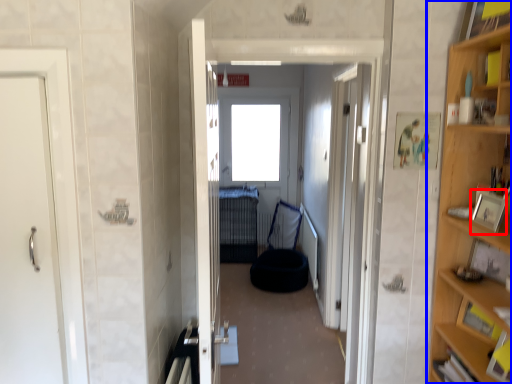
Question: Which object is closer to the camera taking this photo, picture frame (highlighted by a red box) or cabinetry (highlighted by a blue box)?

Choices:
 (A) picture frame
 (B) cabinetry

Answer: (B)